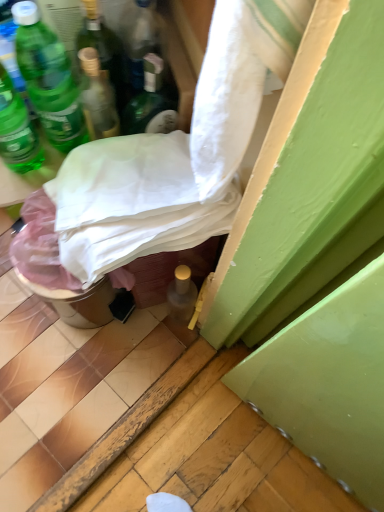
Question: Is metallic silver bucket at lower left outside green glass bottle at upper left, the 1th bottle from the left?

Choices:
 (A) yes
 (B) no

Answer: (A)

Question: Is metallic silver bucket at lower left shorter than green glass bottle at upper left, the 1th bottle from the left?

Choices:
 (A) no
 (B) yes

Answer: (B)

Question: Is metallic silver bucket at lower left thinner than green glass bottle at upper left, the 5th bottle viewed from the right?

Choices:
 (A) yes
 (B) no

Answer: (B)

Question: Does metallic silver bucket at lower left have a larger size compared to green glass bottle at upper left, the 5th bottle viewed from the right?

Choices:
 (A) no
 (B) yes

Answer: (B)

Question: From the image's perspective, is metallic silver bucket at lower left over green glass bottle at upper left, the 1th bottle from the left?

Choices:
 (A) yes
 (B) no

Answer: (B)

Question: From a real-world perspective, is metallic silver bucket at lower left below green glass bottle at upper left, the 5th bottle viewed from the right?

Choices:
 (A) yes
 (B) no

Answer: (A)

Question: From a real-world perspective, is metallic silver bucket at lower left positioned over green matte bottle at upper left, the 2th bottle positioned from the left, based on gravity?

Choices:
 (A) no
 (B) yes

Answer: (A)

Question: From a real-world perspective, is metallic silver bucket at lower left positioned under green matte bottle at upper left, which is the 4th bottle from right to left, based on gravity?

Choices:
 (A) yes
 (B) no

Answer: (A)

Question: Is green matte bottle at upper left, the 2th bottle positioned from the left, at the back of metallic silver bucket at lower left?

Choices:
 (A) no
 (B) yes

Answer: (A)

Question: Is metallic silver bucket at lower left positioned in front of green matte bottle at upper left, which is the 4th bottle from right to left?

Choices:
 (A) yes
 (B) no

Answer: (B)

Question: Are metallic silver bucket at lower left and green matte bottle at upper left, which is the 4th bottle from right to left, beside each other?

Choices:
 (A) no
 (B) yes

Answer: (A)

Question: Can you confirm if metallic silver bucket at lower left is taller than green matte bottle at upper left, which is the 4th bottle from right to left?

Choices:
 (A) yes
 (B) no

Answer: (B)

Question: From the image's perspective, is green matte bottle at upper left, arranged as the 3th bottle when viewed from the right, below green glass bottle at upper left, the 1th bottle from the left?

Choices:
 (A) yes
 (B) no

Answer: (B)